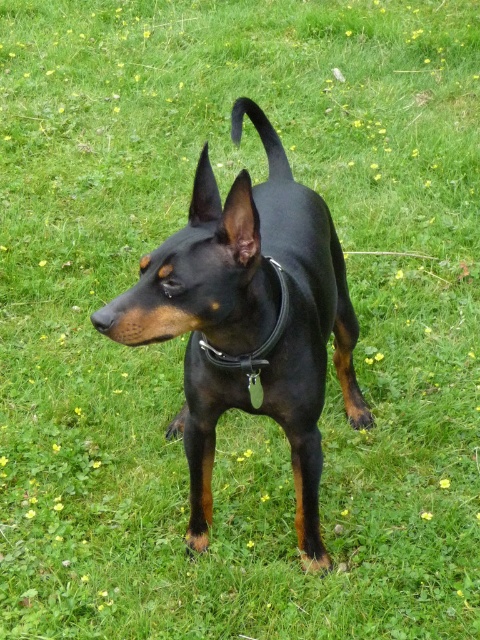
Where is the black smooth dog at center located in the image?

The black smooth dog at center is located at point coordinates of (250,321).

You are a veterinarian examining a dog. You notice the black smooth dog at center and the black leather collar at center. Which object is bigger?

The black smooth dog at center is larger than the black leather collar at center.

You are a photographer trying to capture the black smooth dog at center and its black leather collar at center in a single frame. Based on their positions, can you ensure that both the dog and the collar are fully visible in your shot?

The black smooth dog at center is located below the black leather collar at center, so as long as the camera angle includes the area from the collar downward to the dog, both will be visible in the frame.